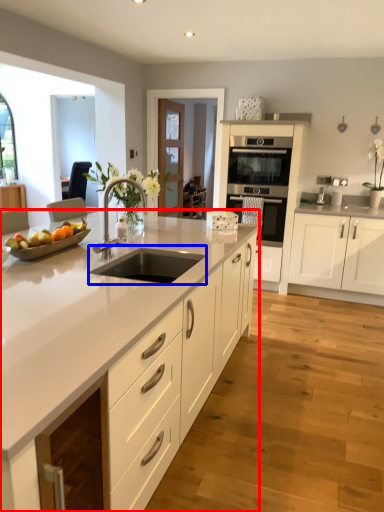
Question: Which of the following is the closest to the observer, cabinetry (highlighted by a red box) or sink (highlighted by a blue box)?

Choices:
 (A) cabinetry
 (B) sink

Answer: (A)